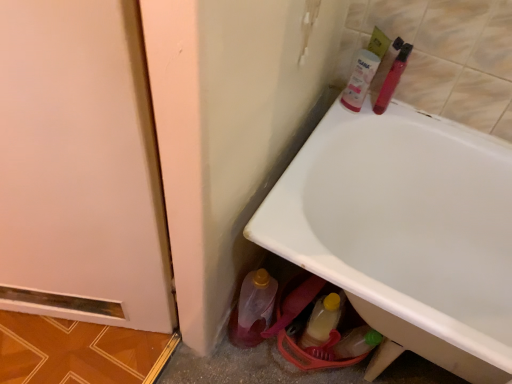
Question: Considering the positions of white glossy bathtub at lower right and pink plastic tube at upper right, the 2th mouthwash viewed from the right, in the image, is white glossy bathtub at lower right wider or thinner than pink plastic tube at upper right, the 2th mouthwash viewed from the right,?

Choices:
 (A) thin
 (B) wide

Answer: (B)

Question: From a real-world perspective, relative to pink plastic tube at upper right, acting as the first mouthwash starting from the left, is white glossy bathtub at lower right vertically above or below?

Choices:
 (A) below
 (B) above

Answer: (A)

Question: Which object is positioned closest to the white glossy bathtub at lower right?

Choices:
 (A) pink plastic tube at upper right, the 2th mouthwash viewed from the right
 (B) translucent plastic bottle at lower center, which is counted as the first bottle, starting from the left
 (C) translucent yellow plastic bottle at lower center, the 2th bottle viewed from the left
 (D) translucent plastic tube at upper right, which ranks as the first mouthwash in right-to-left order

Answer: (C)

Question: Which is nearer to the translucent plastic bottle at lower center, the second bottle viewed from the right?

Choices:
 (A) pink plastic tube at upper right, the 2th mouthwash viewed from the right
 (B) white glossy bathtub at lower right
 (C) translucent plastic tube at upper right, which ranks as the first mouthwash in right-to-left order
 (D) translucent yellow plastic bottle at lower center, the 2th bottle viewed from the left

Answer: (D)